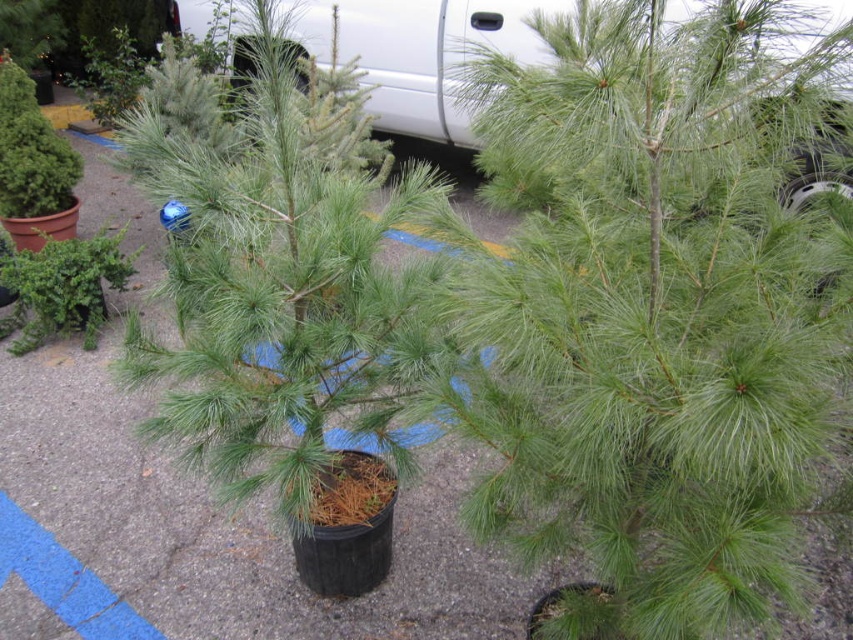
Question: Is green matte tree at center thinner than white matte car at upper center?

Choices:
 (A) yes
 (B) no

Answer: (A)

Question: Can you confirm if green matte tree at center is thinner than white matte car at upper center?

Choices:
 (A) no
 (B) yes

Answer: (B)

Question: Which object appears closest to the camera in this image?

Choices:
 (A) green matte tree at center
 (B) white matte car at upper center

Answer: (A)

Question: Is the position of green matte tree at center more distant than that of white matte car at upper center?

Choices:
 (A) no
 (B) yes

Answer: (A)